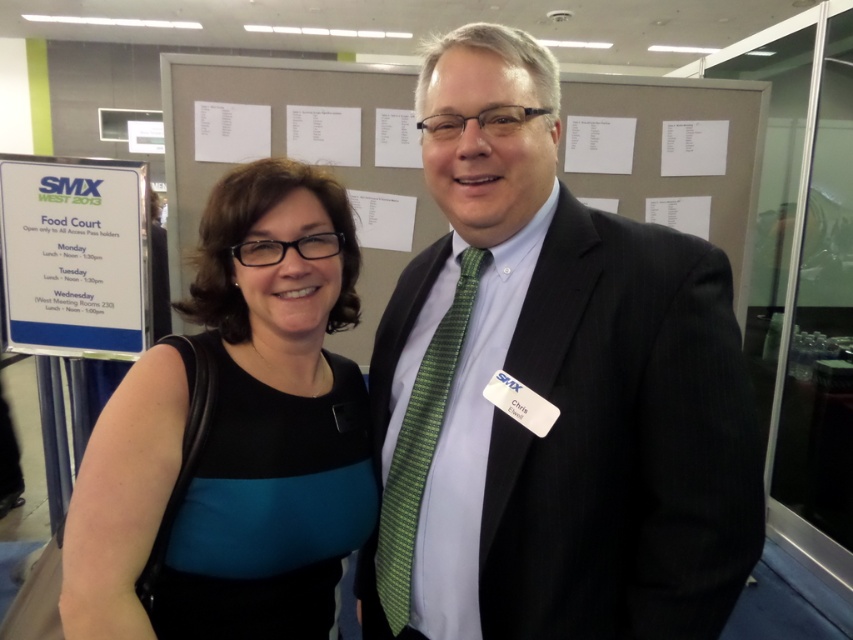
Can you confirm if dark gray suit at center is positioned above black fabric dress at left?

Correct, dark gray suit at center is located above black fabric dress at left.

Can you confirm if dark gray suit at center is shorter than black fabric dress at left?

In fact, dark gray suit at center may be taller than black fabric dress at left.

Who is more distant from viewer, (496, 113) or (148, 518)?

Positioned behind is point (148, 518).

Locate an element on the screen. dark gray suit at center is located at coordinates (550, 392).

Between dark gray suit at center and white paper at center, which one has more height?

Standing taller between the two is white paper at center.

Which is more to the right, dark gray suit at center or white paper at center?

dark gray suit at center

Is point (422, 548) behind point (253, 58)?

No.

This screenshot has width=853, height=640. In order to click on dark gray suit at center in this screenshot , I will do `click(550, 392)`.

How far apart are white paper at center and green textured tie at center?

A distance of 4.71 feet exists between white paper at center and green textured tie at center.

Does white paper at center appear under green textured tie at center?

Actually, white paper at center is above green textured tie at center.

Image resolution: width=853 pixels, height=640 pixels. I want to click on white paper at center, so click(x=276, y=129).